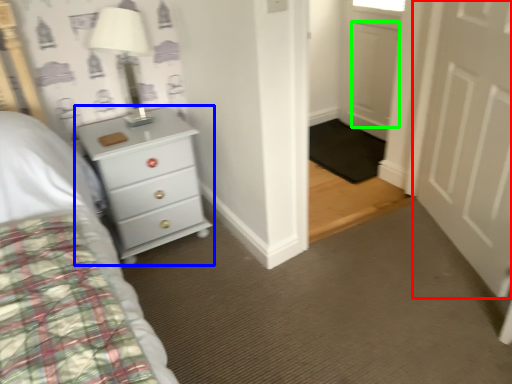
Question: Based on their relative distances, which object is farther from door (highlighted by a red box)? Choose from chest of drawers (highlighted by a blue box) and door (highlighted by a green box).

Choices:
 (A) chest of drawers
 (B) door

Answer: (A)